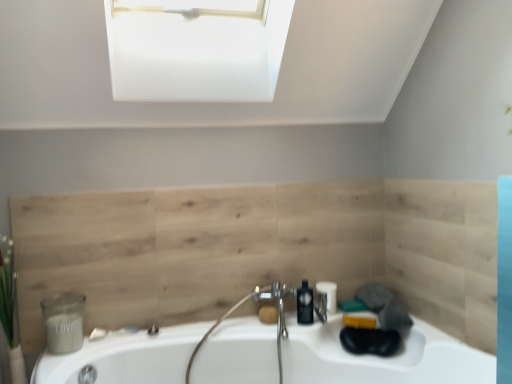
Question: From their relative heights in the image, would you say matte white candle at lower left is taller or shorter than natural wood paneling at center?

Choices:
 (A) tall
 (B) short

Answer: (B)

Question: From the image's perspective, relative to natural wood paneling at center, is matte white candle at lower left above or below?

Choices:
 (A) below
 (B) above

Answer: (A)

Question: Considering the real-world distances, which object is closest to the white glossy bathtub at center?

Choices:
 (A) black plastic soap dispenser at center
 (B) natural wood paneling at center
 (C) matte white candle at lower left
 (D) yellow matte soap at center
 (E) green leafy plant at left

Answer: (B)

Question: Which is farther from the natural wood paneling at center?

Choices:
 (A) black plastic soap dispenser at center
 (B) matte white candle at lower left
 (C) white glossy bathtub at center
 (D) green leafy plant at left
 (E) yellow matte soap at center

Answer: (D)